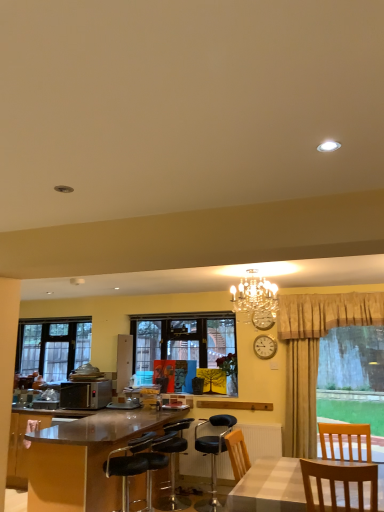
Question: Is clear glass window at left, positioned as the second window in front-to-back order, outside black leather bar stool at center, the 3th chair when ordered from front to back?

Choices:
 (A) yes
 (B) no

Answer: (A)

Question: Is clear glass window at left, the 1th window when ordered from left to right, oriented towards black leather bar stool at center, which is the second chair in left-to-right order?

Choices:
 (A) yes
 (B) no

Answer: (B)

Question: Is clear glass window at left, the 1th window when ordered from left to right, further to camera compared to black leather bar stool at center, which is the second chair in left-to-right order?

Choices:
 (A) yes
 (B) no

Answer: (A)

Question: Considering the relative positions of clear glass window at left, positioned as the second window in front-to-back order, and black leather bar stool at center, the 3th chair when ordered from front to back, in the image provided, is clear glass window at left, positioned as the second window in front-to-back order, to the right of black leather bar stool at center, the 3th chair when ordered from front to back, from the viewer's perspective?

Choices:
 (A) yes
 (B) no

Answer: (B)

Question: Is clear glass window at left, positioned as the second window in front-to-back order, positioned in front of black leather bar stool at center, the first chair from the back?

Choices:
 (A) yes
 (B) no

Answer: (B)

Question: Is satin silver microwave at left bigger or smaller than crystal chandelier at upper center?

Choices:
 (A) small
 (B) big

Answer: (A)

Question: Is satin silver microwave at left inside the boundaries of crystal chandelier at upper center, or outside?

Choices:
 (A) inside
 (B) outside

Answer: (B)

Question: Is satin silver microwave at left wider or thinner than crystal chandelier at upper center?

Choices:
 (A) wide
 (B) thin

Answer: (A)

Question: From a real-world perspective, is satin silver microwave at left above or below crystal chandelier at upper center?

Choices:
 (A) below
 (B) above

Answer: (A)

Question: Would you say clear glass window at left, positioned as the second window in front-to-back order, is to the left or to the right of crystal chandelier at upper center in the picture?

Choices:
 (A) left
 (B) right

Answer: (A)

Question: Considering the positions of clear glass window at left, which is counted as the first window, starting from the back, and crystal chandelier at upper center in the image, is clear glass window at left, which is counted as the first window, starting from the back, taller or shorter than crystal chandelier at upper center?

Choices:
 (A) short
 (B) tall

Answer: (B)

Question: Looking at their shapes, would you say clear glass window at left, which is counted as the first window, starting from the back, is wider or thinner than crystal chandelier at upper center?

Choices:
 (A) wide
 (B) thin

Answer: (B)

Question: From the image's perspective, is clear glass window at left, the 1th window when ordered from left to right, located above or below crystal chandelier at upper center?

Choices:
 (A) below
 (B) above

Answer: (A)

Question: Is point (94, 498) positioned closer to the camera than point (253, 317)?

Choices:
 (A) farther
 (B) closer

Answer: (B)

Question: Is shiny brown desk at lower left situated inside gold metallic clock at upper center or outside?

Choices:
 (A) outside
 (B) inside

Answer: (A)